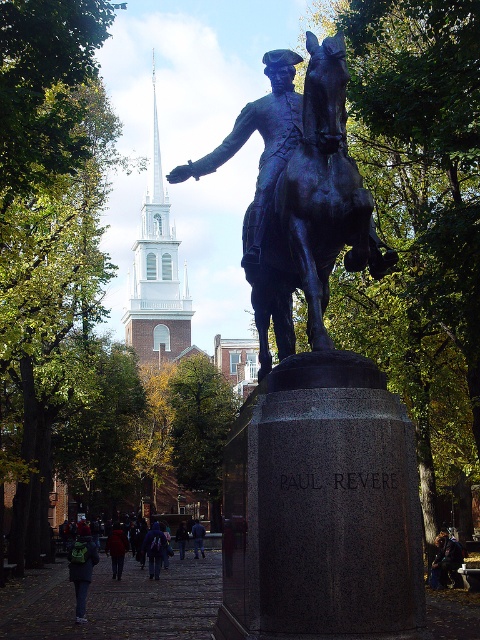
You are standing in the public square and want to take a photo of both the Paul Revere statue and the church steeple. You notice two points marked at coordinates point [179,282] and point [186,538]. Which point should you stand at to ensure both landmarks are visible in your photo?

You should stand at point [186,538] because point [179,282] is behind it, meaning that from point [186,538] you can see both the Paul Revere statue and the church steeple without obstruction.

You are standing in the public square where the Paul Revere statue is located. You notice the white steeple at upper left and the dark blue jeans at lower center. Which object is wider?

The white steeple at upper left might be wider than the dark blue jeans at lower center.